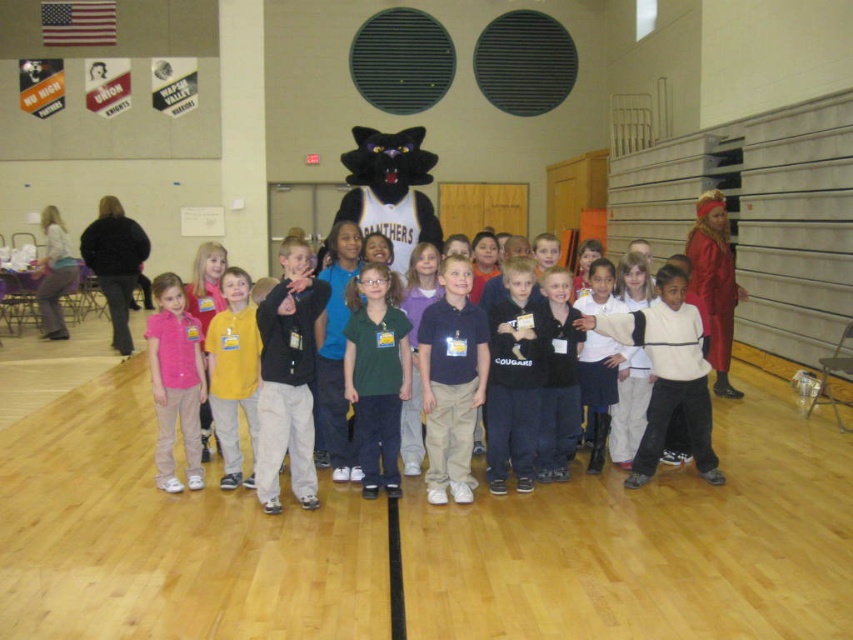
Question: Among these points, which one is nearest to the camera?

Choices:
 (A) (376, 480)
 (B) (445, 291)
 (C) (180, 307)

Answer: (A)

Question: Does black plush mascot at center appear on the right side of pink fabric at left?

Choices:
 (A) no
 (B) yes

Answer: (B)

Question: Is matte black shirt at center wider than dark blue shirt at center?

Choices:
 (A) yes
 (B) no

Answer: (A)

Question: Which object appears farthest from the camera in this image?

Choices:
 (A) matte black shirt at center
 (B) pink fabric at left

Answer: (B)

Question: Is green matte shirt at center to the right of pink fabric shirt at center from the viewer's perspective?

Choices:
 (A) no
 (B) yes

Answer: (B)

Question: Which of these objects is positioned farthest from the dark blue shirt at center?

Choices:
 (A) pink fabric shirt at center
 (B) green matte shirt at center
 (C) pink fabric at left

Answer: (C)